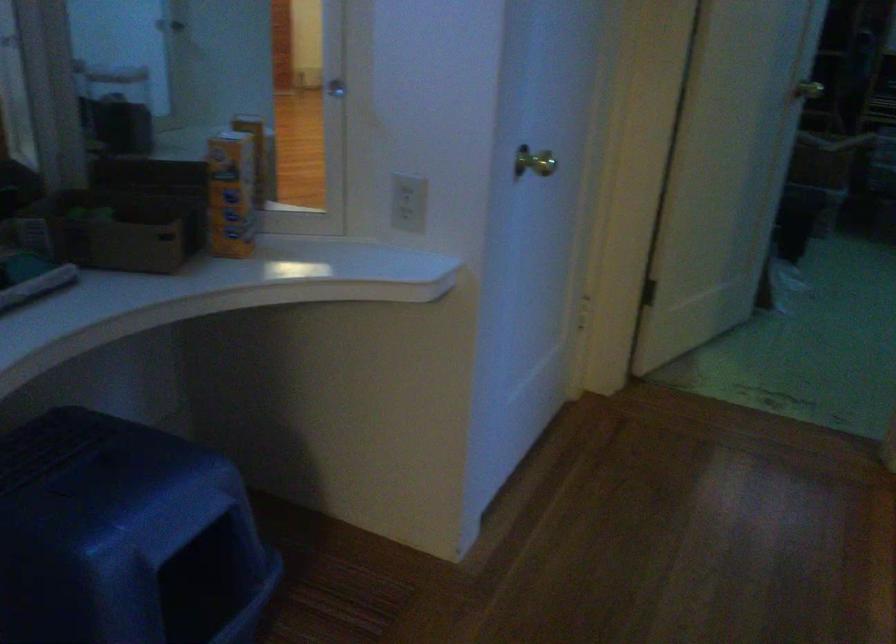
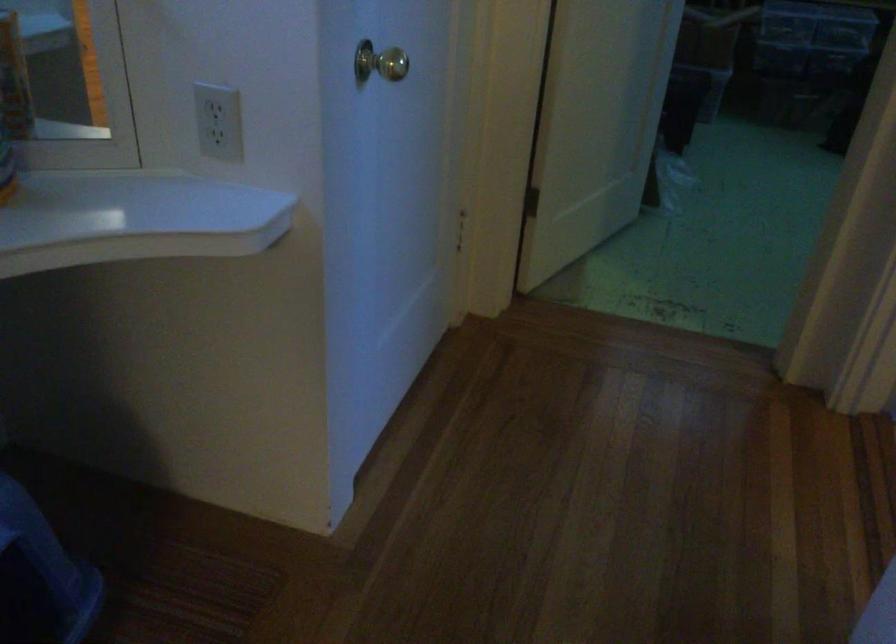
Question: Based on the continuous images, in which direction is the camera rotating? Reply with the corresponding letter.

Choices:
 (A) Left
 (B) Right
 (C) Up
 (D) Down

Answer: (D)